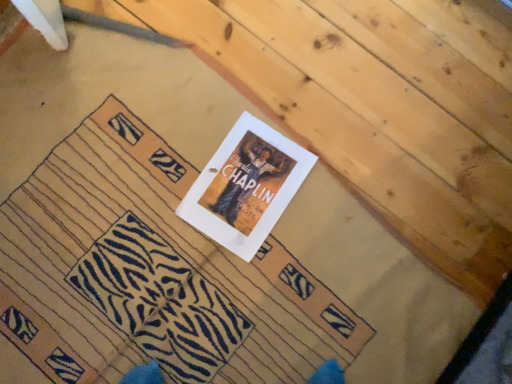
What are the coordinates of `blank space above white paper at center (from a real-world perspective)` in the screenshot? It's located at (156, 284).